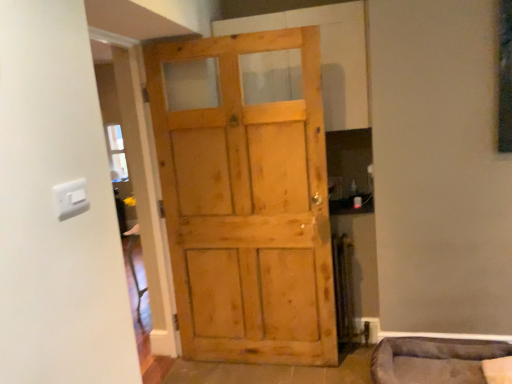
Question: Is white plastic light switch at upper left taller or shorter than velvet grey pet bed at lower right?

Choices:
 (A) short
 (B) tall

Answer: (A)

Question: Is white plastic light switch at upper left situated inside velvet grey pet bed at lower right or outside?

Choices:
 (A) outside
 (B) inside

Answer: (A)

Question: Which of these objects is positioned farthest from the velvet grey pet bed at lower right?

Choices:
 (A) light brown wooden door at center
 (B) white plastic light switch at upper left

Answer: (B)

Question: Considering the real-world distances, which object is closest to the light brown wooden door at center?

Choices:
 (A) velvet grey pet bed at lower right
 (B) white plastic light switch at upper left

Answer: (A)